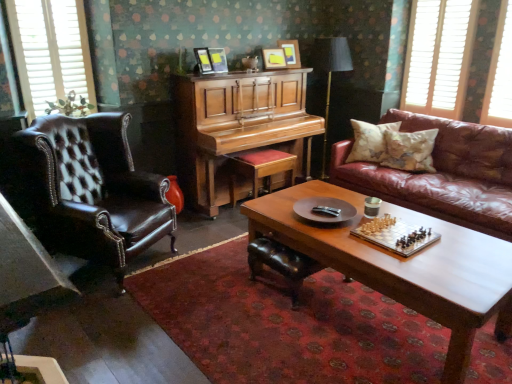
I want to click on vacant space in matte wooden picture frame at upper center, marked as the 2th picture frame in a right-to-left arrangement (from a real-world perspective), so (274, 71).